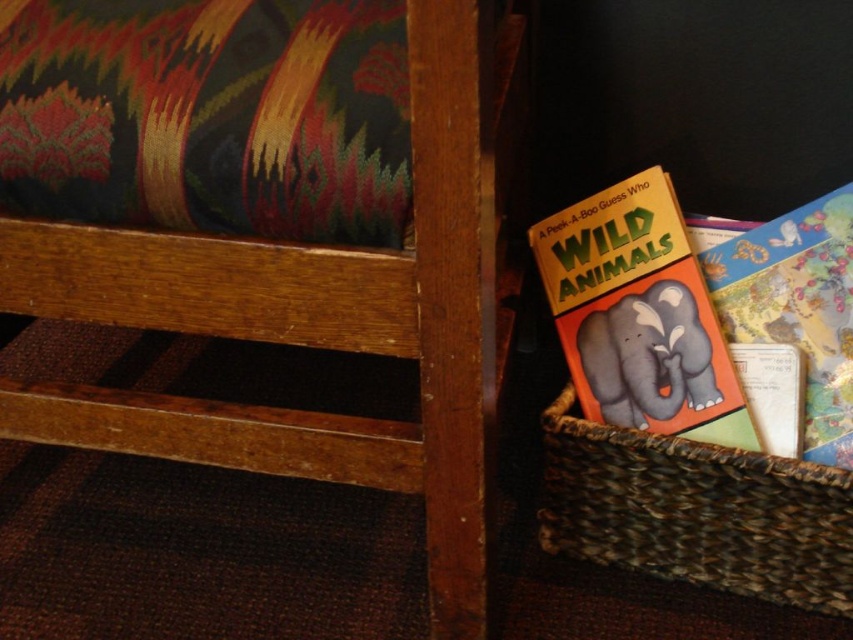
You are standing in the room and want to reach the point at coordinates (160, 221). The distance from you to that point is 22.19 inches. If you have a toy car that can move 1 inch per second, how many seconds will it take for the toy car to reach that point from your current position?

The point at coordinates (160, 221) is 22.19 inches away. Since the toy car moves at 1 inch per second, it will take 22.19 seconds to reach the point.

You are organizing a childrens playroom and need to place a small toy box that is 15 inches wide between the wooden stool at lower left and the matte yellow book at lower right. Can the toy box fit between them based on their widths?

The wooden stool at lower left is wider than the matte yellow book at lower right. Since the toy box is 15 inches wide, it depends on the available space between them. However, without knowing the exact distance between the two objects, we cannot confirm if the toy box will fit. Please measure the space between the wooden stool at lower left and the matte yellow book at lower right first.